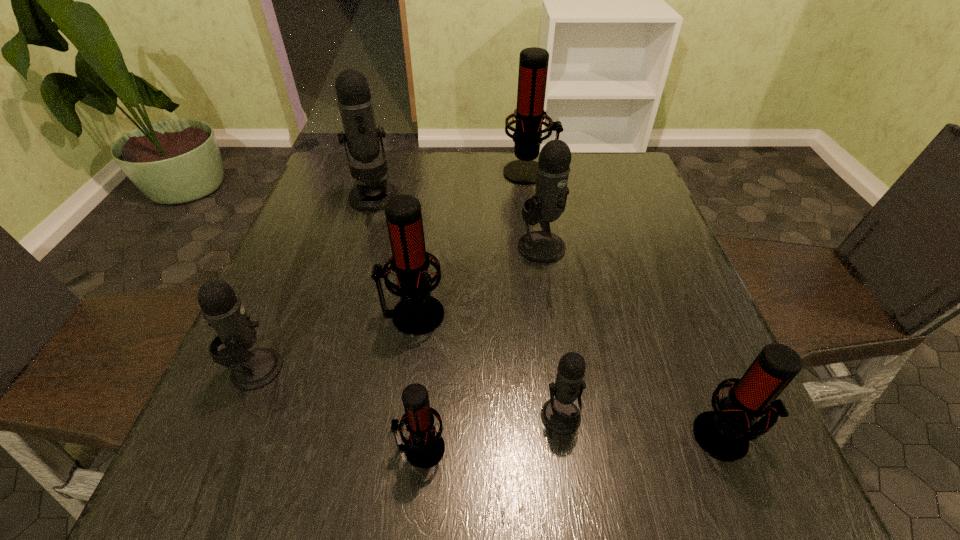
You are a GUI agent. You are given a task and a screenshot of the screen. Output one action in this format:
    pyautogui.click(x=<x>, y=<y>)
    Task: Click on the blank region between the third nearest black microphone and the rightmost microphone
    
    Given the screenshot: What is the action you would take?
    pyautogui.click(x=634, y=341)

This screenshot has height=540, width=960. I want to click on free spot between the smallest red microphone and the fourth nearest object, so click(338, 409).

I want to click on free spot between the nearest black microphone and the third farthest microphone, so click(x=551, y=332).

Locate an element on the screen. The width and height of the screenshot is (960, 540). vacant space that is in between the smallest red microphone and the biggest red microphone is located at coordinates tap(475, 310).

Locate an element on the screen. The width and height of the screenshot is (960, 540). vacant area that lies between the second nearest black microphone and the rightmost red microphone is located at coordinates (491, 403).

Locate an element on the screen. free space between the farthest red microphone and the biggest black microphone is located at coordinates (452, 185).

The height and width of the screenshot is (540, 960). I want to click on vacant region between the fifth nearest object and the smallest red microphone, so click(417, 382).

Find the location of a particular element. The width and height of the screenshot is (960, 540). empty location between the seventh microphone from right to left and the fourth nearest object is located at coordinates (315, 284).

What are the coordinates of `blank region between the third biggest black microphone and the third smallest red microphone` in the screenshot? It's located at click(334, 342).

Identify the location of free spot between the smallest red microphone and the smallest black microphone. The width and height of the screenshot is (960, 540). (491, 433).